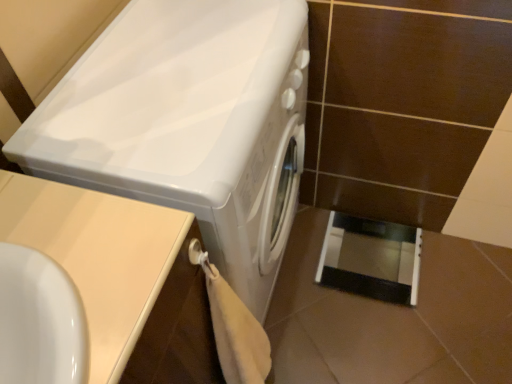
At what (x,y) coordinates should I click in order to perform the action: click on vacant area situated below black glossy screen door at lower right (from a real-world perspective). Please return your answer as a coordinate pair (x, y). The height and width of the screenshot is (384, 512). Looking at the image, I should click on (370, 256).